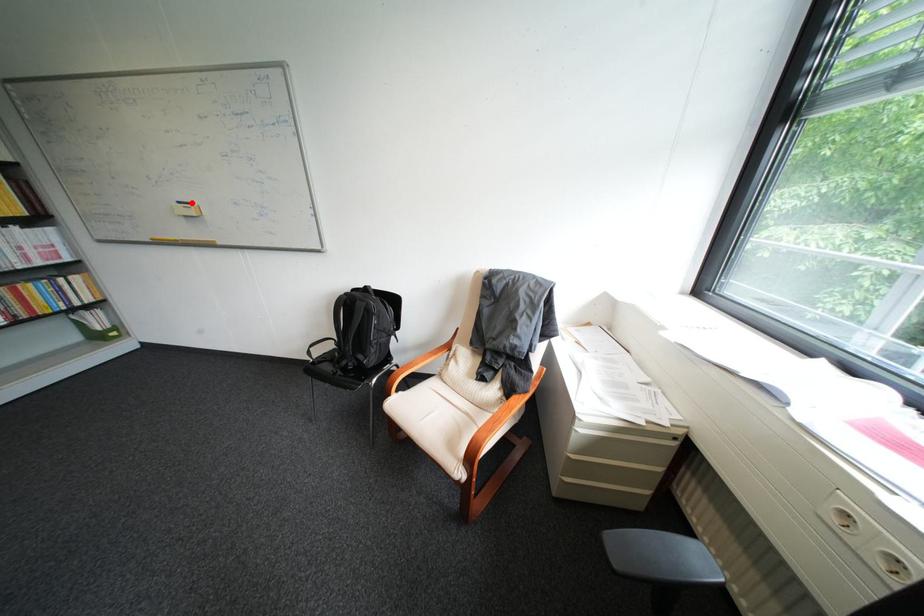
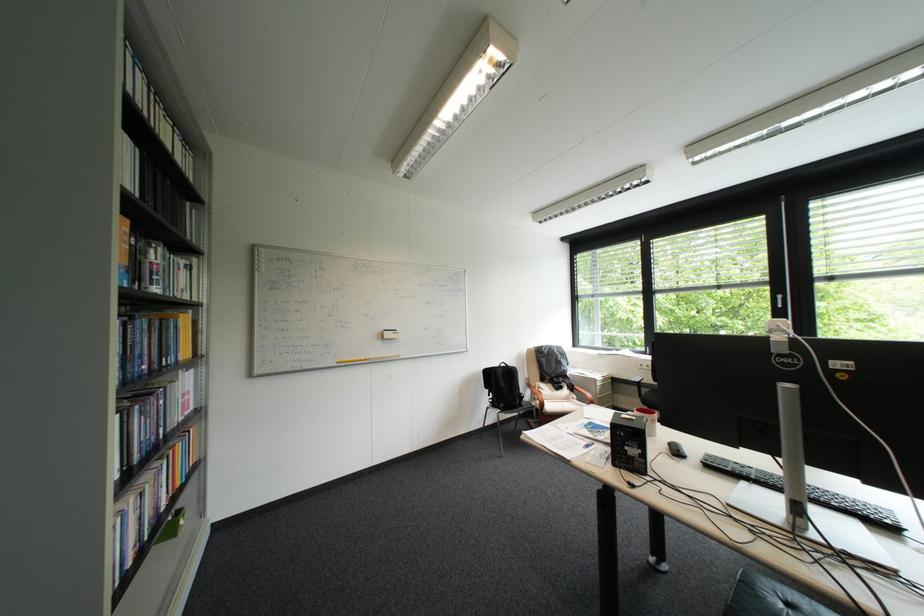
Find the pixel in the second image that matches the highlighted location in the first image.

(397, 331)